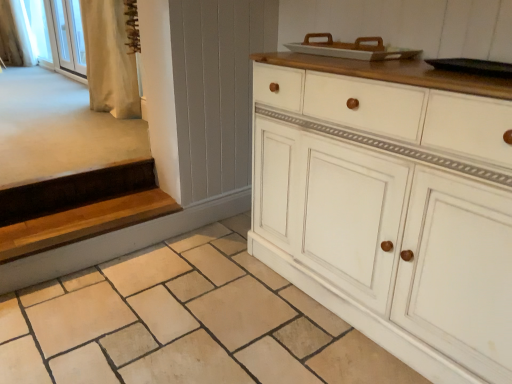
Find the location of `empty space that is ontop of wooden at left (from a real-world perspective)`. empty space that is ontop of wooden at left (from a real-world perspective) is located at coordinates (83, 219).